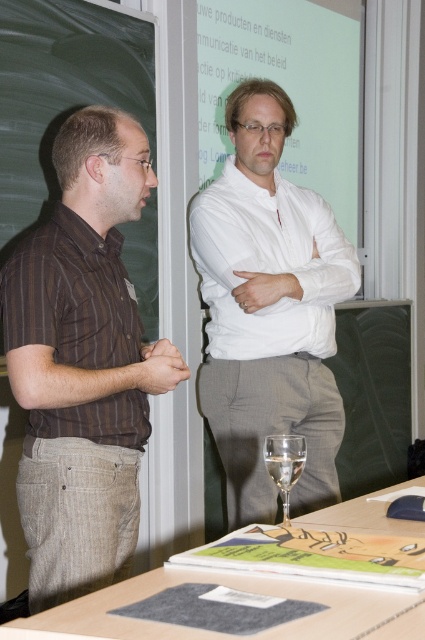
Does white smooth shirt at center have a lesser width compared to black chalkboard at left?

No.

Is point (232, 266) positioned in front of point (132, 42)?

Yes, point (232, 266) is in front of point (132, 42).

The height and width of the screenshot is (640, 425). Identify the location of white smooth shirt at center. point(269,310).

Locate an element on the screen. white smooth shirt at center is located at coordinates (269, 310).

Is the position of black chalkboard at left less distant than that of clear glass wine glass at lower center?

No, it is behind clear glass wine glass at lower center.

Does black chalkboard at left have a greater width compared to clear glass wine glass at lower center?

Correct, the width of black chalkboard at left exceeds that of clear glass wine glass at lower center.

Image resolution: width=425 pixels, height=640 pixels. What do you see at coordinates (61, 92) in the screenshot? I see `black chalkboard at left` at bounding box center [61, 92].

This screenshot has width=425, height=640. What are the coordinates of `black chalkboard at left` in the screenshot? It's located at (61, 92).

Which is more to the right, wooden table at lower center or clear glass wine glass at lower center?

Positioned to the right is clear glass wine glass at lower center.

Does wooden table at lower center have a lesser height compared to clear glass wine glass at lower center?

Yes.

Who is more forward, (x=153, y=573) or (x=289, y=461)?

Point (x=153, y=573) is in front.

Where is `wooden table at lower center`? The image size is (425, 640). wooden table at lower center is located at coordinates (229, 636).